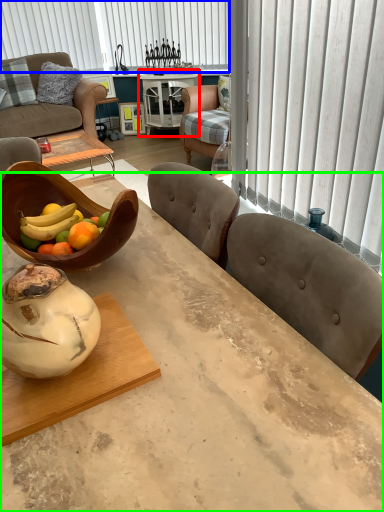
Question: Estimate the real-world distances between objects in this image. Which object is farther from round table (highlighted by a red box), blind (highlighted by a blue box) or desk (highlighted by a green box)?

Choices:
 (A) blind
 (B) desk

Answer: (B)